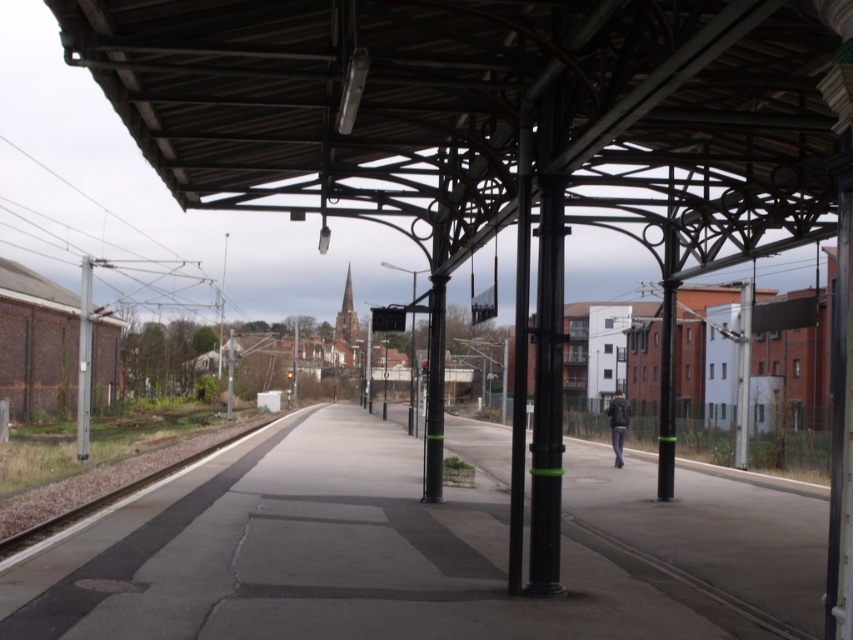
Looking at this image, you are a person with a dark gray jacket at right that is 1 meter wide. You want to walk past the black polished pole at center. Can you pass through the space between the pole and the nearest building without any issues?

The black polished pole at center has a lesser width compared to dark gray jacket at right, so the pole is narrower than your jacket. Since the jacket is 1 meter wide, the pole is less than 1 meter wide. Therefore, you can easily pass through the space between the pole and the nearest building without any issues.

You are standing on the concrete platform at center and want to hand a package to the person wearing the dark gray jacket at right. Which direction should you walk to reach them?

Since the concrete platform at center is closer to you than the dark gray jacket at right, you should walk towards the right side of the platform to reach the person wearing the dark gray jacket at right.

You are a maintenance worker who needs to attach a sign to a pole. The sign requires a pole with a width of at least 10 cm to be securely mounted. You see the black matte pole at center and the metallic pole at left. Which pole should you choose?

The metallic pole at left has a greater width than the black matte pole at center, so you should choose the metallic pole at left to securely mount the sign.